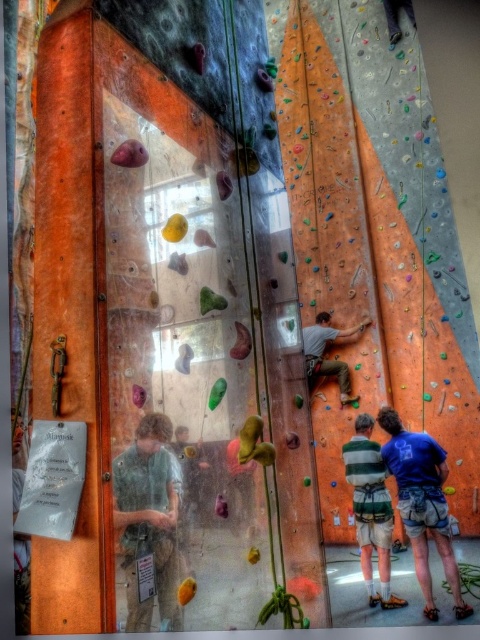
Question: Where is striped cotton shirt at center located in relation to matte orange climbing gear at center in the image?

Choices:
 (A) below
 (B) above

Answer: (A)

Question: Which point is closer to the camera?

Choices:
 (A) (348, 468)
 (B) (148, 625)
 (C) (420, 534)
 (D) (315, 378)

Answer: (B)

Question: Which point appears closest to the camera in this image?

Choices:
 (A) (311, 387)
 (B) (374, 506)
 (C) (170, 522)
 (D) (422, 561)

Answer: (C)

Question: Considering the real-world distances, which object is farthest from the green fabric shirt at lower left?

Choices:
 (A) blue cotton shirt at lower right
 (B) matte orange climbing gear at center

Answer: (B)

Question: Observing the image, what is the correct spatial positioning of green fabric shirt at lower left in reference to striped cotton shirt at center?

Choices:
 (A) left
 (B) right

Answer: (A)

Question: Does green fabric shirt at lower left appear on the left side of matte orange climbing gear at center?

Choices:
 (A) no
 (B) yes

Answer: (B)